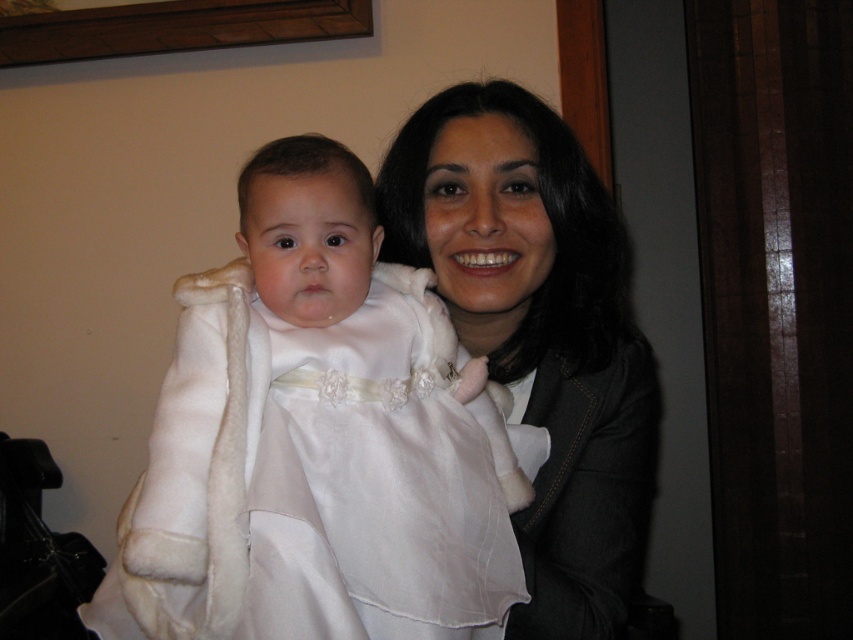
Can you confirm if white satin dress at center is wider than matte white coat at center?

No.

Where is `white satin dress at center`? Image resolution: width=853 pixels, height=640 pixels. white satin dress at center is located at coordinates (366, 426).